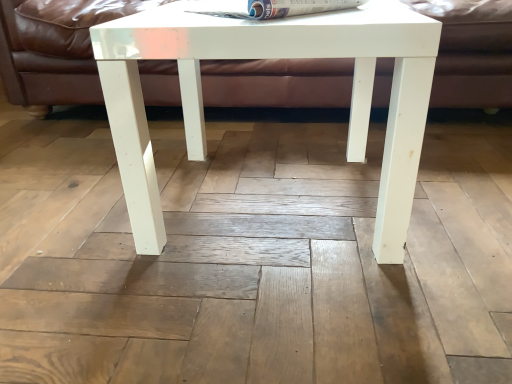
Question: From the image's perspective, is white glossy magazine at upper center under white glossy table at center?

Choices:
 (A) yes
 (B) no

Answer: (B)

Question: Is white glossy magazine at upper center shorter than white glossy table at center?

Choices:
 (A) yes
 (B) no

Answer: (A)

Question: Can white glossy table at center be found inside white glossy magazine at upper center?

Choices:
 (A) yes
 (B) no

Answer: (B)

Question: Considering the relative positions of white glossy magazine at upper center and white glossy table at center in the image provided, is white glossy magazine at upper center to the left of white glossy table at center from the viewer's perspective?

Choices:
 (A) no
 (B) yes

Answer: (A)

Question: Does white glossy magazine at upper center have a larger size compared to white glossy table at center?

Choices:
 (A) yes
 (B) no

Answer: (B)

Question: From a real-world perspective, relative to matte brown leather couch at upper center, is white glossy magazine at upper center vertically above or below?

Choices:
 (A) below
 (B) above

Answer: (B)

Question: From their relative heights in the image, would you say white glossy magazine at upper center is taller or shorter than matte brown leather couch at upper center?

Choices:
 (A) tall
 (B) short

Answer: (B)

Question: Choose the correct answer: Is white glossy magazine at upper center inside matte brown leather couch at upper center or outside it?

Choices:
 (A) inside
 (B) outside

Answer: (B)

Question: From the image's perspective, is white glossy magazine at upper center located above or below matte brown leather couch at upper center?

Choices:
 (A) above
 (B) below

Answer: (B)

Question: Is white glossy table at center inside or outside of matte brown leather couch at upper center?

Choices:
 (A) outside
 (B) inside

Answer: (A)

Question: Considering their positions, is white glossy table at center located in front of or behind matte brown leather couch at upper center?

Choices:
 (A) behind
 (B) front

Answer: (B)

Question: Based on their positions, is white glossy table at center located to the left or right of matte brown leather couch at upper center?

Choices:
 (A) left
 (B) right

Answer: (A)

Question: Is point (x=109, y=36) closer or farther from the camera than point (x=174, y=66)?

Choices:
 (A) closer
 (B) farther

Answer: (A)

Question: Is white glossy table at center wider or thinner than white glossy magazine at upper center?

Choices:
 (A) thin
 (B) wide

Answer: (B)

Question: Considering the relative positions of white glossy table at center and white glossy magazine at upper center in the image provided, is white glossy table at center to the left or to the right of white glossy magazine at upper center?

Choices:
 (A) left
 (B) right

Answer: (A)